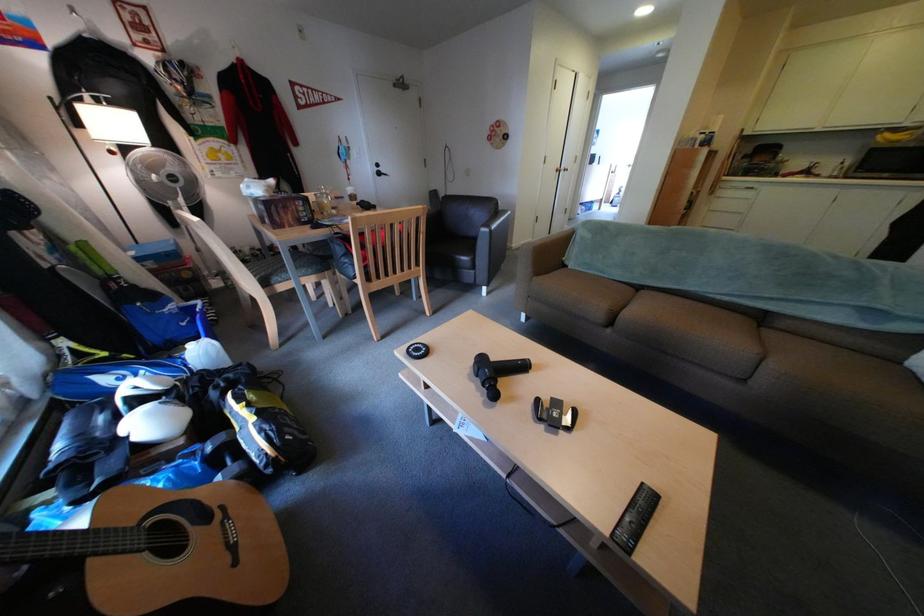
Where is `acoustic guitar`? The width and height of the screenshot is (924, 616). acoustic guitar is located at coordinates (152, 554).